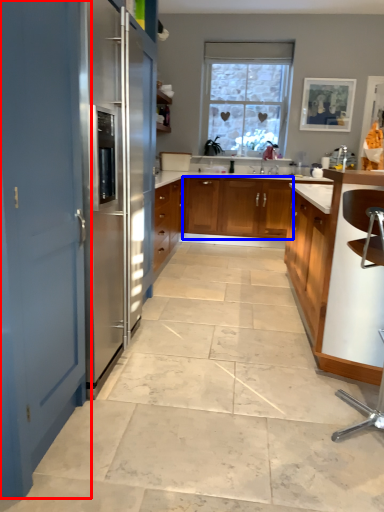
Question: Which of the following is the closest to the observer, door (highlighted by a red box) or cabinetry (highlighted by a blue box)?

Choices:
 (A) door
 (B) cabinetry

Answer: (A)